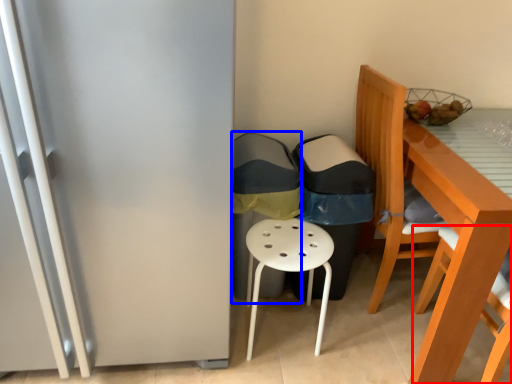
Question: Which point is further to the camera, chair (highlighted by a red box) or garbage (highlighted by a blue box)?

Choices:
 (A) chair
 (B) garbage

Answer: (B)